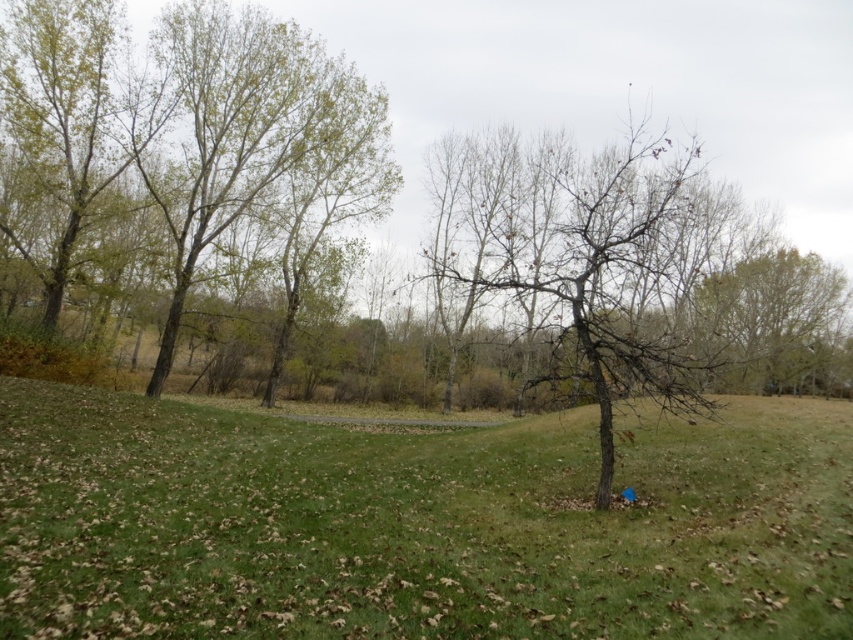
You are a bird looking for a nesting spot. You see the bare wood tree at center and the green leafy tree at upper left. Which tree would you choose if you want to build a nest higher up?

The bare wood tree at center is much taller than the green leafy tree at upper left, so you should choose the bare wood tree at center to build a nest higher up.